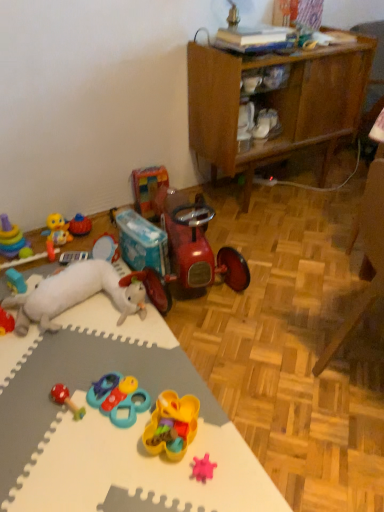
I want to click on vacant area situated to the left side of translucent yellow plastic toy at center, marked as the 11th toy in a left-to-right arrangement, so click(x=110, y=450).